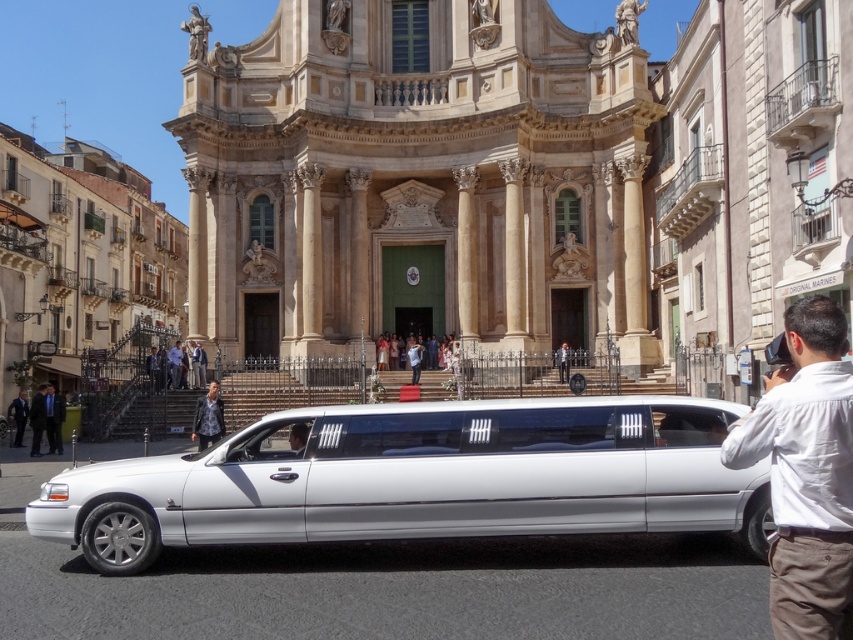
Who is positioned more to the left, beige stone cathedral at center or smooth black hair at center?

smooth black hair at center is more to the left.

What do you see at coordinates (418, 179) in the screenshot? Image resolution: width=853 pixels, height=640 pixels. I see `beige stone cathedral at center` at bounding box center [418, 179].

Locate an element on the screen. The height and width of the screenshot is (640, 853). beige stone cathedral at center is located at coordinates (418, 179).

Who is lower down, white cotton shirt at lower right or dark suit at left?

dark suit at left is lower down.

Is white cotton shirt at lower right taller than dark suit at left?

Correct, white cotton shirt at lower right is much taller as dark suit at left.

The image size is (853, 640). What do you see at coordinates (805, 474) in the screenshot?
I see `white cotton shirt at lower right` at bounding box center [805, 474].

Locate an element on the screen. The width and height of the screenshot is (853, 640). white cotton shirt at lower right is located at coordinates (805, 474).

This screenshot has height=640, width=853. Identify the location of beige stone cathedral at center. (418, 179).

This screenshot has width=853, height=640. I want to click on beige stone cathedral at center, so click(x=418, y=179).